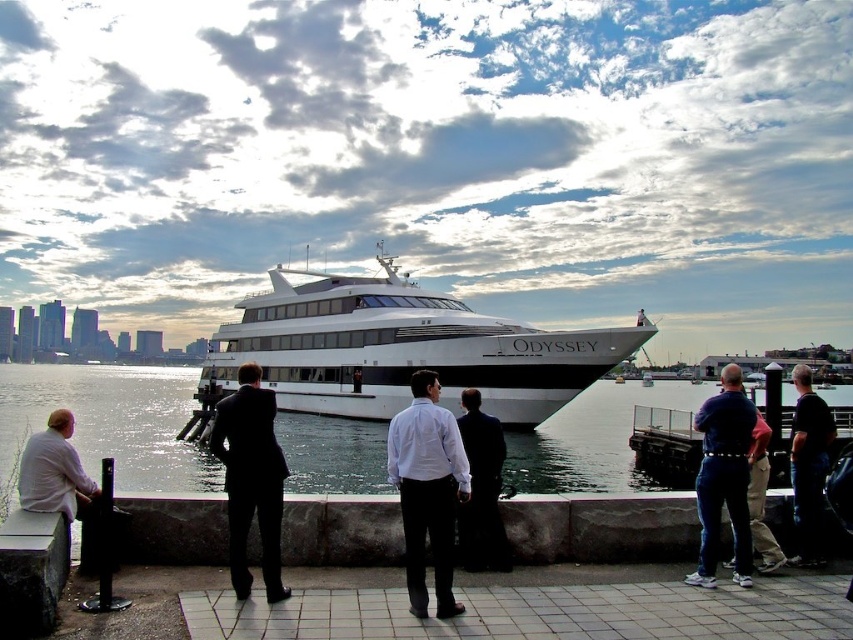
Question: Observing the image, what is the correct spatial positioning of black suit at center in reference to black smooth shirt at right?

Choices:
 (A) left
 (B) right

Answer: (A)

Question: Can you confirm if clear water at center is smaller than dark blue jeans at center?

Choices:
 (A) no
 (B) yes

Answer: (A)

Question: Does dark blue jeans at right come behind dark blue jeans at center?

Choices:
 (A) no
 (B) yes

Answer: (A)

Question: Which point is closer to the camera?

Choices:
 (A) black suit at center
 (B) black smooth shirt at right
 (C) white glossy cruise ship at center
 (D) white shirt at left

Answer: (D)

Question: Estimate the real-world distances between objects in this image. Which object is closer to the dark blue jeans at right?

Choices:
 (A) white glossy cruise ship at center
 (B) white smooth shirt at center

Answer: (B)

Question: Which object is the farthest from the dark blue jeans at center?

Choices:
 (A) white shirt at left
 (B) white smooth shirt at center
 (C) dark suit at center

Answer: (A)